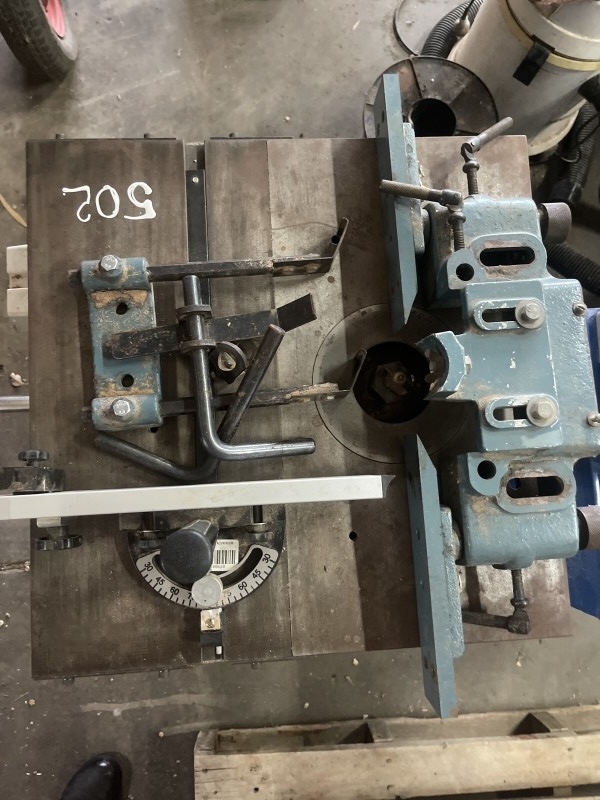
At what (x,y) coordinates should I click in order to perform the action: click on wooden board. Please return your answer as a coordinate pair (x, y). Looking at the image, I should click on (463, 772).